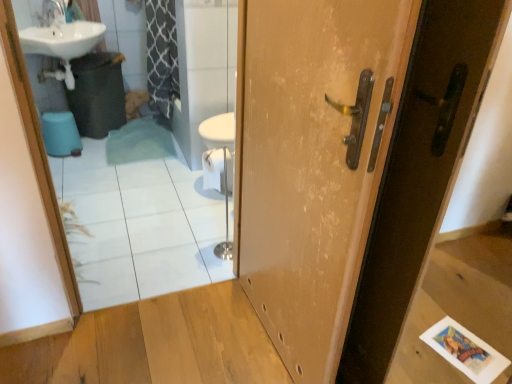
I want to click on blank space to the left of wooden door at center, so click(x=194, y=337).